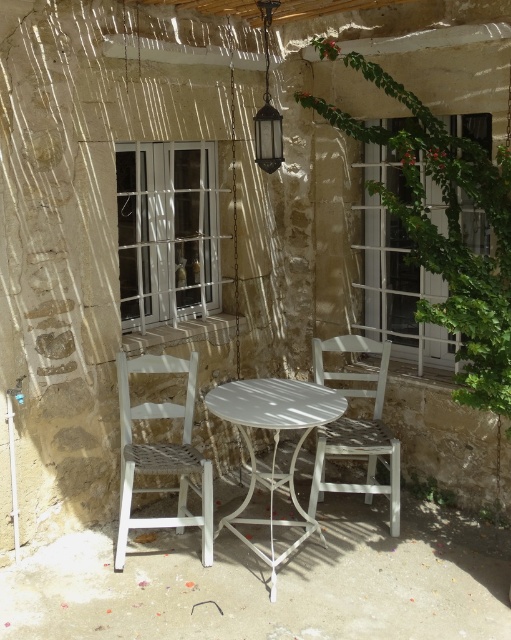
At what (x,y) coordinates should I click in order to perform the action: click on white woven chair at left. Please return your answer as a coordinate pair (x, y). The height and width of the screenshot is (640, 511). Looking at the image, I should click on (161, 452).

Does point (189, 422) lie behind point (385, 452)?

Yes, it is behind point (385, 452).

Is point (187, 522) less distant than point (318, 499)?

Yes, point (187, 522) is closer to viewer.

At what (x,y) coordinates should I click in order to perform the action: click on white woven chair at left. Please return your answer as a coordinate pair (x, y). Looking at the image, I should click on (161, 452).

Does white woven chair at left appear on the left side of white metal table at center?

Indeed, white woven chair at left is positioned on the left side of white metal table at center.

Between white woven chair at left and white metal table at center, which one has more height?

With more height is white woven chair at left.

The width and height of the screenshot is (511, 640). I want to click on white woven chair at left, so click(x=161, y=452).

Does white metal table at center appear on the left side of matte glass lantern at upper center?

Yes, white metal table at center is to the left of matte glass lantern at upper center.

Between point (284, 428) and point (269, 116), which one is positioned in front?

Point (284, 428) is in front.

Locate an element on the screen. white metal table at center is located at coordinates (273, 445).